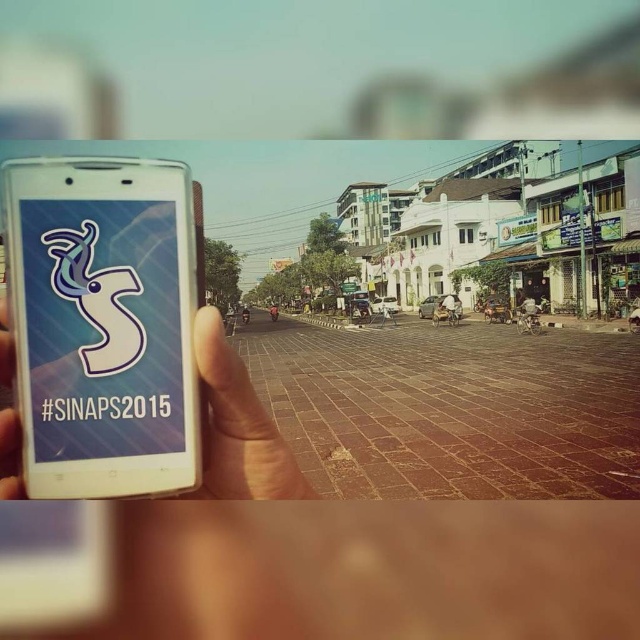
Question: Which point is farther to the camera?

Choices:
 (A) white matte phone at center
 (B) white glossy smartphone at left

Answer: (A)

Question: Does white glossy smartphone at left lie behind white matte phone at center?

Choices:
 (A) yes
 (B) no

Answer: (B)

Question: Among these points, which one is farthest from the camera?

Choices:
 (A) (225, 362)
 (B) (140, 353)

Answer: (B)

Question: Is white glossy smartphone at left to the right of white matte phone at center from the viewer's perspective?

Choices:
 (A) no
 (B) yes

Answer: (A)

Question: Which point is closer to the camera taking this photo?

Choices:
 (A) (77, 170)
 (B) (212, 326)

Answer: (B)

Question: Considering the relative positions of white glossy smartphone at left and white matte phone at center in the image provided, where is white glossy smartphone at left located with respect to white matte phone at center?

Choices:
 (A) above
 (B) below

Answer: (A)